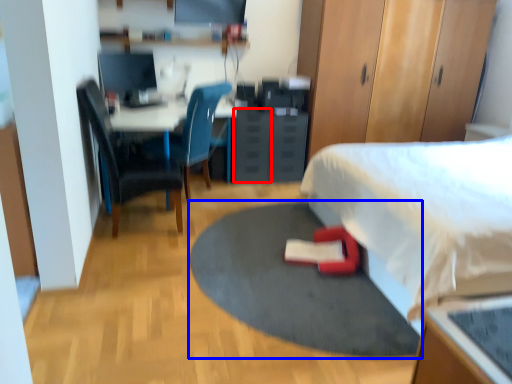
Question: Among these objects, which one is farthest to the camera, drawer (highlighted by a red box) or yoga mat (highlighted by a blue box)?

Choices:
 (A) drawer
 (B) yoga mat

Answer: (A)